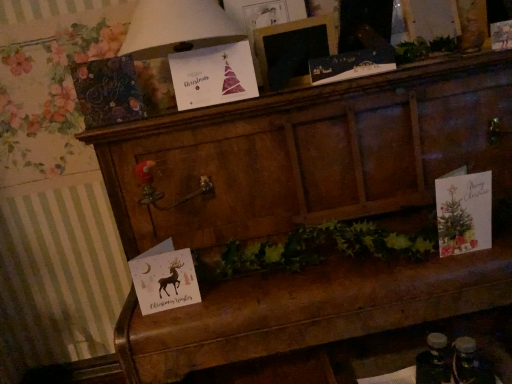
Identify the location of free space in front of matte black card at upper center, the first christmas card from the top. This screenshot has width=512, height=384. (355, 81).